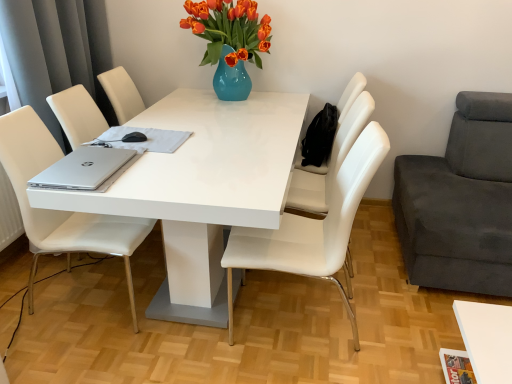
Locate an element on the screen. The image size is (512, 384). vacant area that is situated to the right of silver metallic laptop at left is located at coordinates (152, 167).